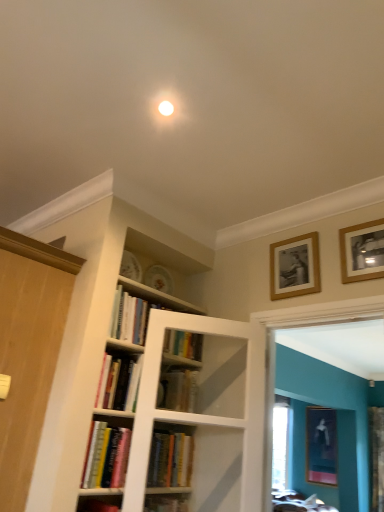
Question: From a real-world perspective, is hardcover books at center, the first book viewed from the top, on top of matte black picture frame at lower right, the 1th picture frame when ordered from back to front?

Choices:
 (A) yes
 (B) no

Answer: (A)

Question: Is hardcover books at center, the first book viewed from the top, at the right side of matte black picture frame at lower right, the first picture frame positioned from the bottom?

Choices:
 (A) yes
 (B) no

Answer: (B)

Question: Is hardcover books at center, positioned as the 4th book in bottom-to-top order, located outside matte black picture frame at lower right, which appears as the 3th picture frame when viewed from the left?

Choices:
 (A) yes
 (B) no

Answer: (A)

Question: Is hardcover books at center, positioned as the 4th book in bottom-to-top order, placed right next to matte black picture frame at lower right, positioned as the 1th picture frame in right-to-left order?

Choices:
 (A) no
 (B) yes

Answer: (A)

Question: Considering the relative sizes of hardcover books at center, the first book viewed from the top, and matte black picture frame at lower right, which is the third picture frame in front-to-back order, in the image provided, is hardcover books at center, the first book viewed from the top, smaller than matte black picture frame at lower right, which is the third picture frame in front-to-back order,?

Choices:
 (A) no
 (B) yes

Answer: (B)

Question: From a real-world perspective, is hardcover books at lower left, the fourth book when ordered from top to bottom, above or below hardcover books at center, positioned as the 4th book in bottom-to-top order?

Choices:
 (A) above
 (B) below

Answer: (B)

Question: In the image, is hardcover books at lower left, the fourth book when ordered from top to bottom, positioned in front of or behind hardcover books at center, the first book viewed from the top?

Choices:
 (A) behind
 (B) front

Answer: (B)

Question: Is hardcover books at lower left, the 1th book when ordered from bottom to top, spatially inside hardcover books at center, the first book viewed from the top, or outside of it?

Choices:
 (A) inside
 (B) outside

Answer: (B)

Question: From the image's perspective, is hardcover books at lower left, the 1th book when ordered from bottom to top, located above or below hardcover books at center, positioned as the 4th book in bottom-to-top order?

Choices:
 (A) below
 (B) above

Answer: (A)

Question: Relative to hardcover books at lower left, the fourth book when ordered from top to bottom, is matte black picture frame at lower right, which is the third picture frame in front-to-back order, in front or behind?

Choices:
 (A) front
 (B) behind

Answer: (B)

Question: Is matte black picture frame at lower right, which appears as the 3th picture frame when viewed from the left, wider or thinner than hardcover books at lower left, the 1th book when ordered from bottom to top?

Choices:
 (A) thin
 (B) wide

Answer: (A)

Question: From a real-world perspective, relative to hardcover books at lower left, the fourth book when ordered from top to bottom, is matte black picture frame at lower right, positioned as the 1th picture frame in right-to-left order, vertically above or below?

Choices:
 (A) above
 (B) below

Answer: (A)

Question: From the image's perspective, is matte black picture frame at lower right, which is the third picture frame in front-to-back order, above or below hardcover books at lower left, the 1th book when ordered from bottom to top?

Choices:
 (A) above
 (B) below

Answer: (B)

Question: In the image, is hardcover books at center, positioned as the 4th book in bottom-to-top order, positioned in front of or behind hardcover book at center, arranged as the second book when viewed from the top?

Choices:
 (A) front
 (B) behind

Answer: (B)

Question: Considering the positions of point (140, 307) and point (127, 367), is point (140, 307) closer or farther from the camera than point (127, 367)?

Choices:
 (A) farther
 (B) closer

Answer: (A)